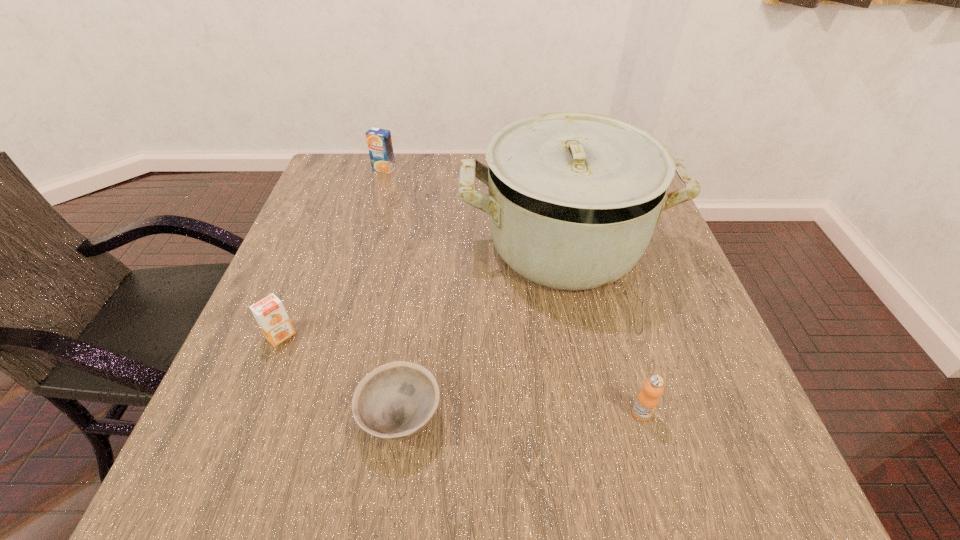
Locate an element on the screen. vacant space situated on the front of the fourth object from right to left is located at coordinates (366, 232).

Locate an element on the screen. The image size is (960, 540). free point located 0.080m on the front label of the rightmost orange juice is located at coordinates (658, 471).

You are a GUI agent. You are given a task and a screenshot of the screen. Output one action in this format:
    pyautogui.click(x=<x>, y=<y>)
    Task: Click on the vacant region located 0.140m on the back of the third nearest object
    This screenshot has width=960, height=540.
    Given the screenshot: What is the action you would take?
    pyautogui.click(x=305, y=274)

Identify the location of vacant space located 0.190m on the right of the shortest object. The height and width of the screenshot is (540, 960). (558, 418).

This screenshot has height=540, width=960. I want to click on saucepan that is at the far edge, so click(573, 198).

What are the coordinates of `orange_juice located in the far edge section of the desktop` in the screenshot? It's located at click(379, 141).

What are the coordinates of `object present at the near edge` in the screenshot? It's located at (394, 402).

This screenshot has width=960, height=540. Identify the location of saucepan that is at the right edge. (573, 198).

You are a GUI agent. You are given a task and a screenshot of the screen. Output one action in this format:
    pyautogui.click(x=<x>, y=<y>)
    Task: Click on the orange juice situated at the right edge
    
    Given the screenshot: What is the action you would take?
    pyautogui.click(x=647, y=400)

You are a GUI agent. You are given a task and a screenshot of the screen. Output one action in this format:
    pyautogui.click(x=<x>, y=<y>)
    Task: Click on the object that is at the far left corner
    
    Given the screenshot: What is the action you would take?
    point(379,141)